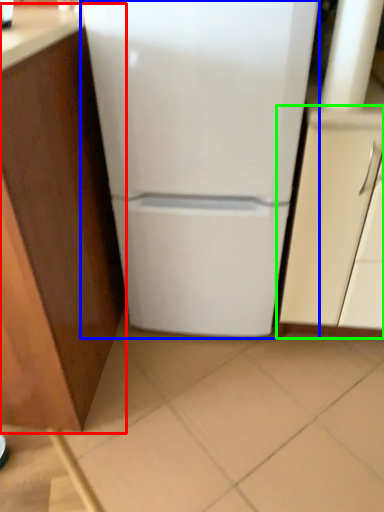
Question: Based on their relative distances, which object is farther from cabinetry (highlighted by a red box)? Choose from refrigerator (highlighted by a blue box) and cabinetry (highlighted by a green box).

Choices:
 (A) refrigerator
 (B) cabinetry

Answer: (B)